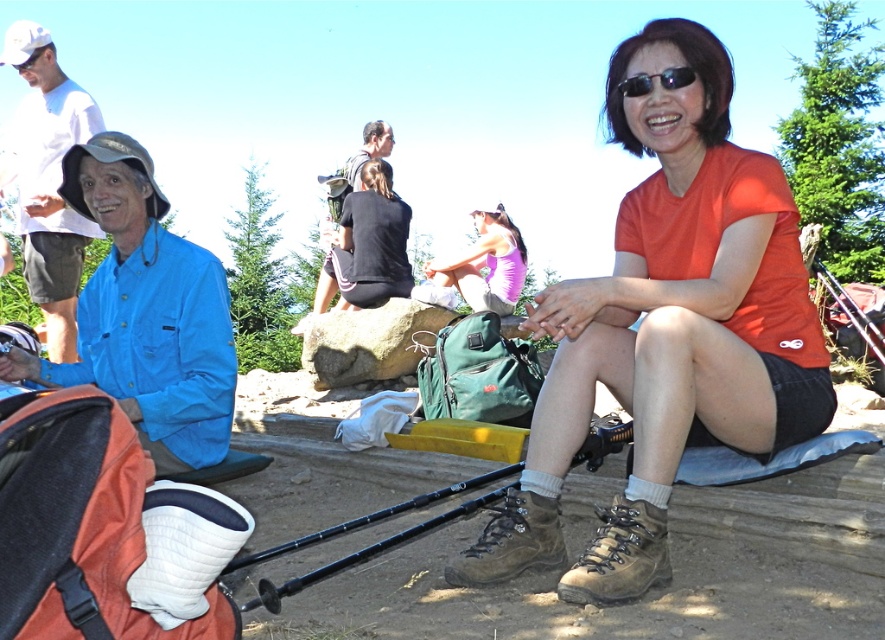
You are planning to pack your gear for a hiking trip and need to decide whether to bring both the blue fabric jacket at upper left and the black plastic pole at lower center. Given their sizes, will they fit together in a standard backpack compartment that can hold items up to 1.5 cubic feet? Please explain your reasoning.

The blue fabric jacket at upper left is larger in size than the black plastic pole at lower center. However, without knowing the exact volume of each item, it is impossible to determine if they will fit together in the backpack compartment. Consider checking the individual sizes or choosing one item if space is limited.